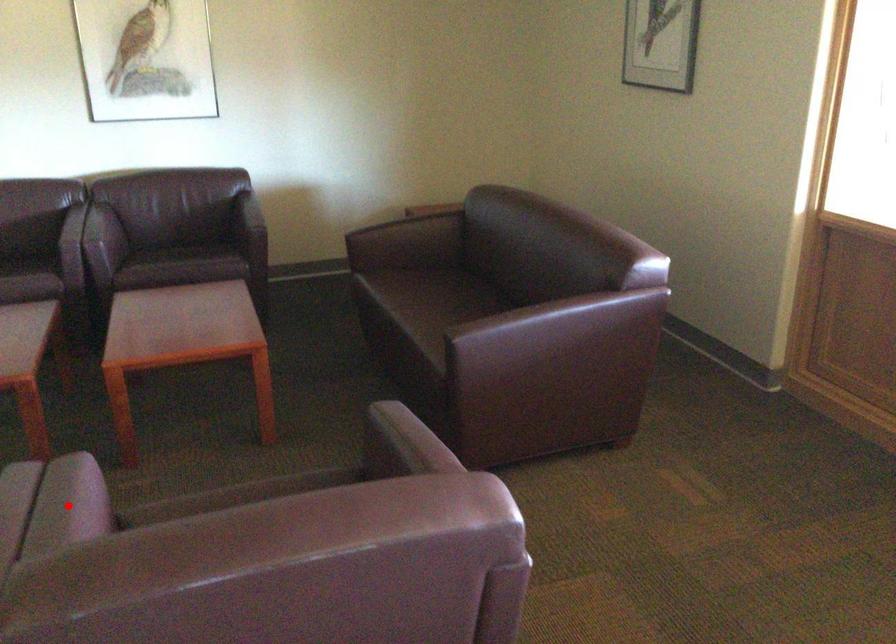
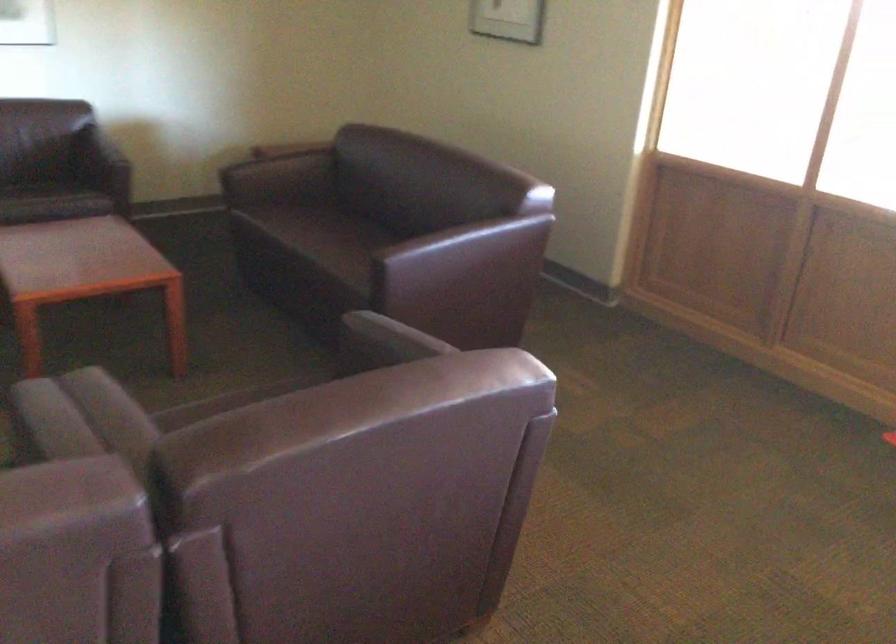
Question: I am providing you with two images of the same scene from different viewpoints. A red point is marked on the first image. At the location where the point appears in image 1, is it still visible in image 2?

Choices:
 (A) Yes
 (B) No

Answer: (B)